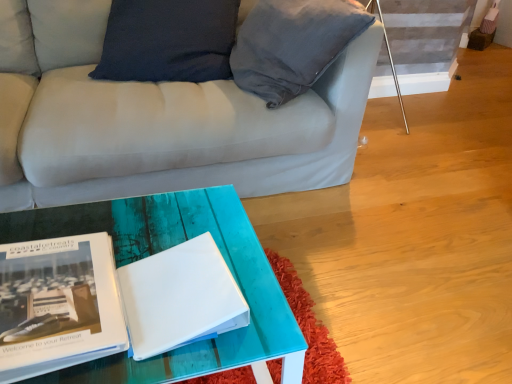
The width and height of the screenshot is (512, 384). I want to click on white matte book at center, so click(180, 298).

Image resolution: width=512 pixels, height=384 pixels. Describe the element at coordinates (180, 298) in the screenshot. I see `white matte book at center` at that location.

You are a GUI agent. You are given a task and a screenshot of the screen. Output one action in this format:
    pyautogui.click(x=<x>, y=<y>)
    Task: Click on the matte black book at lower left
    This screenshot has width=512, height=384.
    Given the screenshot: What is the action you would take?
    pyautogui.click(x=58, y=305)

What do you see at coordinates (58, 305) in the screenshot? This screenshot has height=384, width=512. I see `matte black book at lower left` at bounding box center [58, 305].

This screenshot has height=384, width=512. What are the coordinates of `white matte book at center` in the screenshot? It's located at (180, 298).

Is white matte book at center to the left of matte black book at lower left from the viewer's perspective?

No, white matte book at center is not to the left of matte black book at lower left.

Relative to matte black book at lower left, is white matte book at center in front or behind?

In the image, white matte book at center appears behind matte black book at lower left.

Which point is more forward, (246, 324) or (90, 352)?

The point (90, 352) is in front.

From the image's perspective, relative to matte black book at lower left, is white matte book at center above or below?

white matte book at center is above matte black book at lower left.

Looking at this image, from a real-world perspective, is white matte book at center beneath matte black book at lower left?

No, from a real-world perspective, white matte book at center is not below matte black book at lower left.

Considering the sizes of white matte book at center and matte black book at lower left in the image, is white matte book at center wider or thinner than matte black book at lower left?

Considering their sizes, white matte book at center looks slimmer than matte black book at lower left.

Is white matte book at center shorter than matte black book at lower left?

Yes.

Looking at the image, does white matte book at center seem bigger or smaller compared to matte black book at lower left?

Considering their sizes, white matte book at center takes up less space than matte black book at lower left.

Is white matte book at center positioned beyond the bounds of matte black book at lower left?

Absolutely, white matte book at center is external to matte black book at lower left.

Is white matte book at center touching matte black book at lower left?

white matte book at center is not next to matte black book at lower left, and they're not touching.

Does white matte book at center turn towards matte black book at lower left?

No, white matte book at center is not aimed at matte black book at lower left.

In the scene shown: How different are the orientations of white matte book at center and matte black book at lower left in degrees?

1.46 degrees.

Where is `magazine that appears behind the matte black book at lower left`? The height and width of the screenshot is (384, 512). magazine that appears behind the matte black book at lower left is located at coordinates (180, 298).

Looking at this image, can you confirm if matte black book at lower left is positioned to the left of white matte book at center?

Yes.

Which object is further away from the camera taking this photo, matte black book at lower left or white matte book at center?

Positioned behind is white matte book at center.

Which is behind, point (118, 321) or point (179, 334)?

Positioned behind is point (118, 321).

In the scene shown: From the image's perspective, which object appears higher, matte black book at lower left or white matte book at center?

From the image's view, white matte book at center is above.

From a real-world perspective, who is located lower, matte black book at lower left or white matte book at center?

In real-world perspective, matte black book at lower left is lower.

In terms of width, does matte black book at lower left look wider or thinner when compared to white matte book at center?

matte black book at lower left is wider than white matte book at center.

Does matte black book at lower left have a lesser height compared to white matte book at center?

No.

Based on their sizes in the image, would you say matte black book at lower left is bigger or smaller than white matte book at center?

In the image, matte black book at lower left appears to be larger than white matte book at center.

Would you say matte black book at lower left is inside or outside white matte book at center?

matte black book at lower left lies outside white matte book at center.

Is matte black book at lower left touching white matte book at center?

matte black book at lower left and white matte book at center are clearly separated.

Is matte black book at lower left aimed at white matte book at center?

No, matte black book at lower left does not turn towards white matte book at center.

Can you tell me how much matte black book at lower left and white matte book at center differ in facing direction?

The angle between the facing direction of matte black book at lower left and the facing direction of white matte book at center is 1.46 degrees.

Where is `magazine located on the right of matte black book at lower left`? This screenshot has width=512, height=384. magazine located on the right of matte black book at lower left is located at coordinates (180, 298).

Image resolution: width=512 pixels, height=384 pixels. What are the coordinates of `book in front of the white matte book at center` in the screenshot? It's located at (58, 305).

This screenshot has width=512, height=384. I want to click on magazine behind the matte black book at lower left, so click(180, 298).